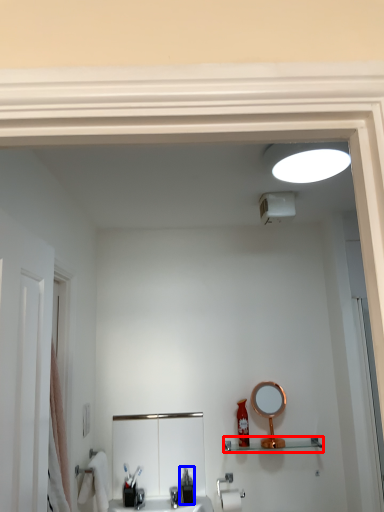
Question: Which object appears closest to the camera in this image, shelve (highlighted by a red box) or soap dispenser (highlighted by a blue box)?

Choices:
 (A) shelve
 (B) soap dispenser

Answer: (B)